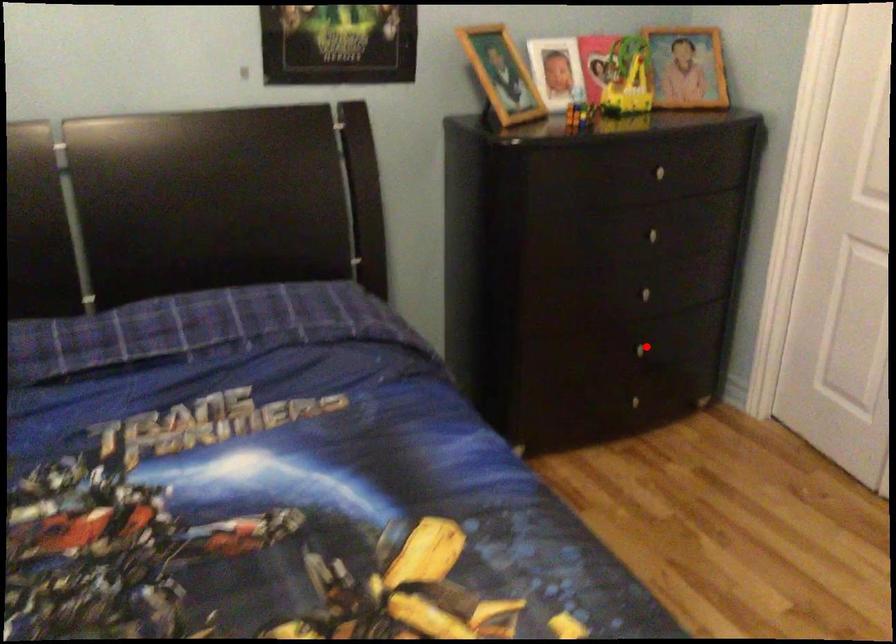
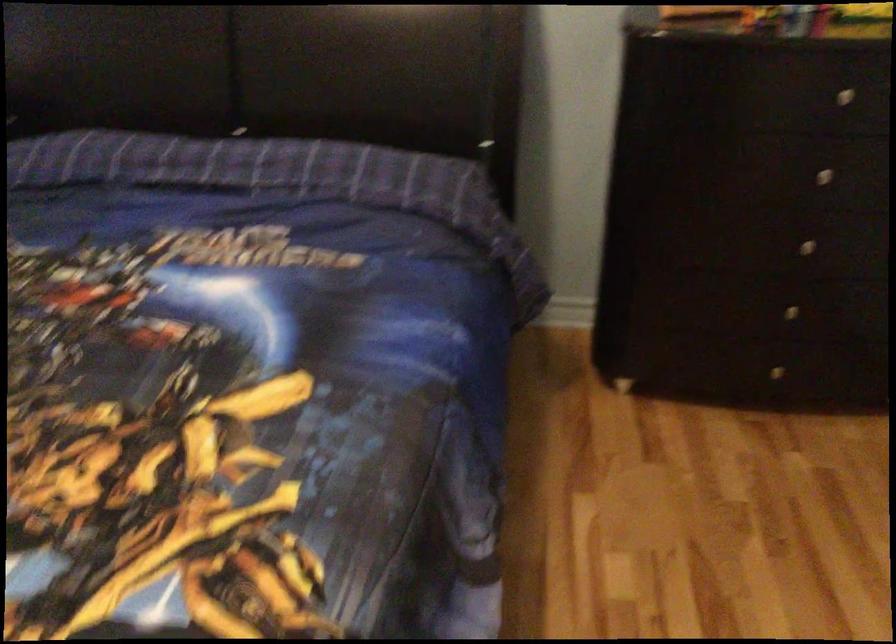
Question: A red point is marked in image1. In image2, is the corresponding 3D point closer to the camera or farther? Reply with the corresponding letter.

Choices:
 (A) The corresponding 3D point is closer.
 (B) The corresponding 3D point is farther.

Answer: (A)